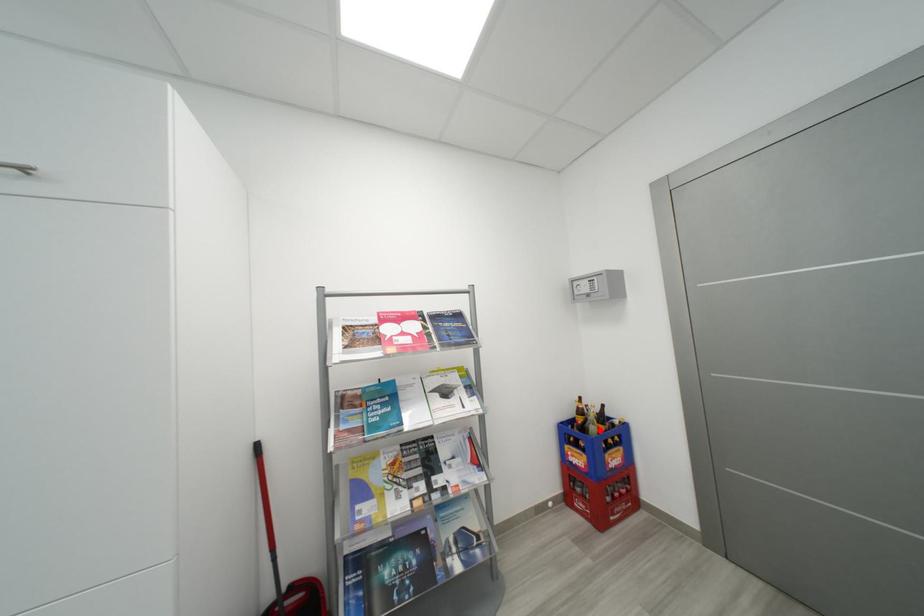
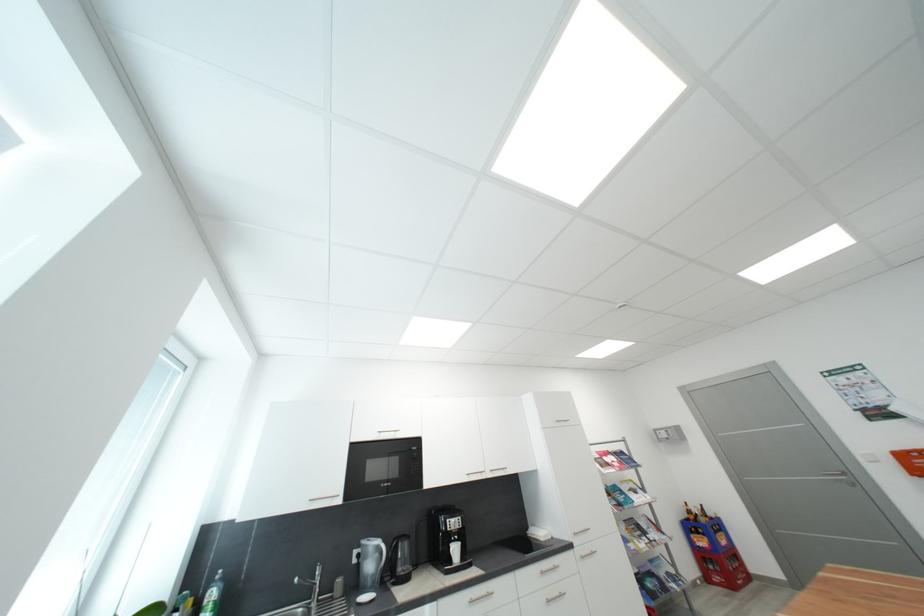
The point at the highlighted location is marked in the first image. Where is the corresponding point in the second image?

(710, 522)